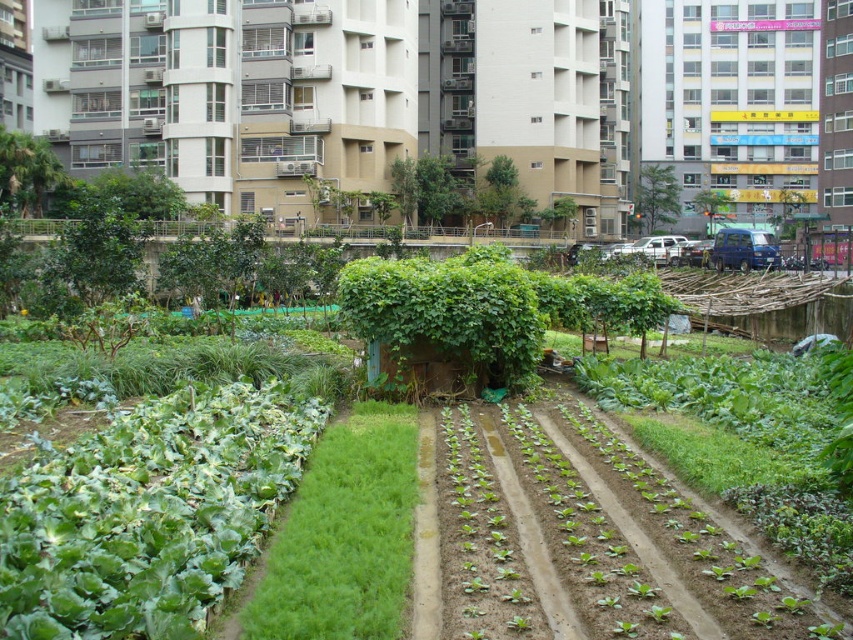
Who is higher up, green leafy vegetables at center or green leafy grass at center?

green leafy grass at center is above.

Does green leafy vegetables at center have a larger size compared to green leafy grass at center?

Incorrect, green leafy vegetables at center is not larger than green leafy grass at center.

This screenshot has width=853, height=640. I want to click on green leafy vegetables at center, so click(x=149, y=513).